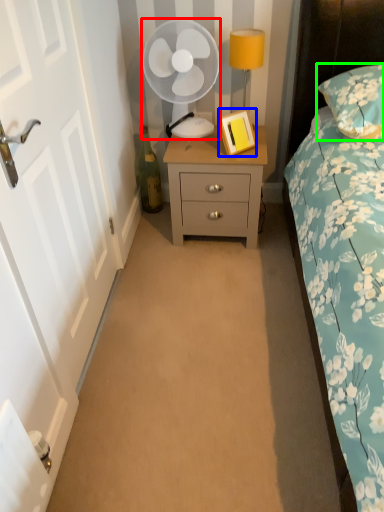
Question: Based on their relative distances, which object is farther from mechanical fan (highlighted by a red box)? Choose from picture frame (highlighted by a blue box) and pillow (highlighted by a green box).

Choices:
 (A) picture frame
 (B) pillow

Answer: (B)